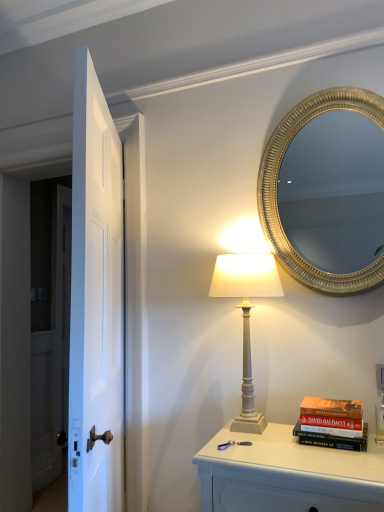
Where is `white matte table lamp at center`? white matte table lamp at center is located at coordinates (246, 316).

In order to face white glossy door at left, should I rotate leftwards or rightwards?

Rotate your view left by about 11.626°.

Image resolution: width=384 pixels, height=512 pixels. Identify the location of hardcover book at right. (331, 434).

Locate an element on the screen. This screenshot has height=512, width=384. white painted wood nightstand at lower right is located at coordinates (288, 474).

Considering the relative sizes of hardcover book at right and white painted wood nightstand at lower right in the image provided, is hardcover book at right taller than white painted wood nightstand at lower right?

Incorrect, the height of hardcover book at right is not larger of that of white painted wood nightstand at lower right.

Is point (350, 441) farther from viewer compared to point (271, 488)?

Yes, point (350, 441) is farther from viewer.

Can you confirm if hardcover book at right is smaller than white painted wood nightstand at lower right?

Correct, hardcover book at right occupies less space than white painted wood nightstand at lower right.

From the image's perspective, is hardcover book at right located above white painted wood nightstand at lower right?

Yes.

Is white glossy door at left a part of white painted wood nightstand at lower right?

Definitely not — white glossy door at left is not inside white painted wood nightstand at lower right.

How many degrees apart are the facing directions of white painted wood nightstand at lower right and white glossy door at left?

white painted wood nightstand at lower right and white glossy door at left are facing 64.8 degrees away from each other.

From a real-world perspective, which object rests below the other?

white painted wood nightstand at lower right, from a real-world perspective.

Which of these two, white painted wood nightstand at lower right or white glossy door at left, stands taller?

With more height is white glossy door at left.

Is hardcover book at right further to camera compared to white matte table lamp at center?

No, the depth of hardcover book at right is less than that of white matte table lamp at center.

Is hardcover book at right positioned beyond the bounds of white matte table lamp at center?

Absolutely, hardcover book at right is external to white matte table lamp at center.

Is hardcover book at right not near white matte table lamp at center?

hardcover book at right is near white matte table lamp at center, not far away.

From the image's perspective, relative to gold textured mirror at upper right, is white matte table lamp at center above or below?

white matte table lamp at center is below gold textured mirror at upper right.

Considering the relative sizes of white matte table lamp at center and gold textured mirror at upper right in the image provided, is white matte table lamp at center bigger than gold textured mirror at upper right?

Correct, white matte table lamp at center is larger in size than gold textured mirror at upper right.

Is white matte table lamp at center thinner than gold textured mirror at upper right?

No, white matte table lamp at center is not thinner than gold textured mirror at upper right.

Is white matte table lamp at center looking in the opposite direction of gold textured mirror at upper right?

No, white matte table lamp at center is not facing away from gold textured mirror at upper right.

Is the depth of white painted wood nightstand at lower right greater than that of white matte table lamp at center?

No, the depth of white painted wood nightstand at lower right is less than that of white matte table lamp at center.

From the image's perspective, which is above, white painted wood nightstand at lower right or white matte table lamp at center?

white matte table lamp at center is shown above in the image.

Considering the sizes of white painted wood nightstand at lower right and white matte table lamp at center in the image, is white painted wood nightstand at lower right taller or shorter than white matte table lamp at center?

white painted wood nightstand at lower right is shorter than white matte table lamp at center.

Are white painted wood nightstand at lower right and white matte table lamp at center located far from each other?

Actually, white painted wood nightstand at lower right and white matte table lamp at center are a little close together.

Are white matte table lamp at center and white glossy door at left far apart?

No, white matte table lamp at center is not far away from white glossy door at left.

What's the angular difference between white matte table lamp at center and white glossy door at left's facing directions?

65.4 degrees.

Based on the photo, is white matte table lamp at center situated inside white glossy door at left or outside?

white matte table lamp at center is spatially situated outside white glossy door at left.

Visually, is white glossy door at left positioned to the left or to the right of white matte table lamp at center?

In the image, white glossy door at left appears on the left side of white matte table lamp at center.

Is point (79, 490) more distant than point (251, 391)?

No, it is not.

From a real-world perspective, which object stands above the other?

In real-world perspective, white glossy door at left is above.

From the image's perspective, is white glossy door at left under white matte table lamp at center?

Actually, white glossy door at left appears above white matte table lamp at center in the image.

The height and width of the screenshot is (512, 384). I want to click on nightstand below the hardcover book at right (from a real-world perspective), so click(x=288, y=474).

Where is `door above the white painted wood nightstand at lower right (from a real-world perspective)`? door above the white painted wood nightstand at lower right (from a real-world perspective) is located at coordinates (95, 301).

Which object lies further to the anchor point gold textured mirror at upper right, hardcover book at right or white matte table lamp at center?

Based on the image, hardcover book at right appears to be further to gold textured mirror at upper right.

Based on their spatial positions, is white matte table lamp at center or hardcover book at right closer to white glossy door at left?

white matte table lamp at center lies closer to white glossy door at left than the other object.

Looking at the image, which one is located closer to gold textured mirror at upper right, white painted wood nightstand at lower right or white matte table lamp at center?

white matte table lamp at center is closer to gold textured mirror at upper right.

Looking at the image, which one is located further to white glossy door at left, hardcover book at right or white matte table lamp at center?

hardcover book at right is positioned further to the anchor white glossy door at left.

Considering their positions, is white matte table lamp at center positioned closer to white painted wood nightstand at lower right than white glossy door at left?

white matte table lamp at center is closer to white painted wood nightstand at lower right.

In the scene shown: Estimate the real-world distances between objects in this image. Which object is further from gold textured mirror at upper right, white glossy door at left or white matte table lamp at center?

The object further to gold textured mirror at upper right is white glossy door at left.

Considering their positions, is gold textured mirror at upper right positioned closer to white glossy door at left than hardcover book at right?

Based on the image, hardcover book at right appears to be nearer to white glossy door at left.

Considering their positions, is gold textured mirror at upper right positioned closer to white painted wood nightstand at lower right than white glossy door at left?

white glossy door at left lies closer to white painted wood nightstand at lower right than the other object.

This screenshot has height=512, width=384. Identify the location of book located between white glossy door at left and gold textured mirror at upper right in the left-right direction. tap(331, 434).

Image resolution: width=384 pixels, height=512 pixels. I want to click on door between gold textured mirror at upper right and white painted wood nightstand at lower right in the up-down direction, so click(x=95, y=301).

Where is `table lamp between white glossy door at left and gold textured mirror at upper right from left to right`? Image resolution: width=384 pixels, height=512 pixels. table lamp between white glossy door at left and gold textured mirror at upper right from left to right is located at coordinates (246, 316).

Find the location of a particular element. table lamp located between white glossy door at left and hardcover book at right in the left-right direction is located at coordinates (246, 316).